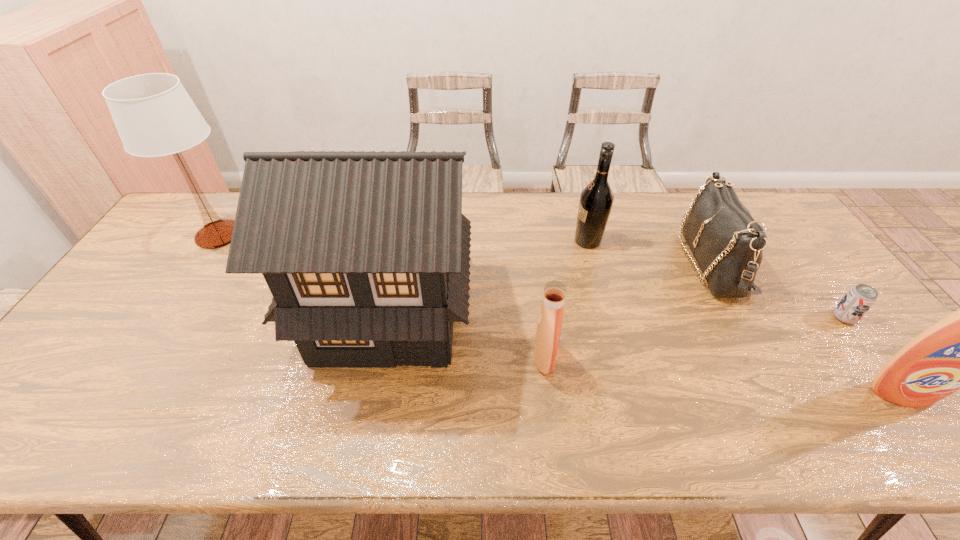
Image resolution: width=960 pixels, height=540 pixels. I want to click on free point that keeps the detergents evenly spaced on the left, so coord(227,328).